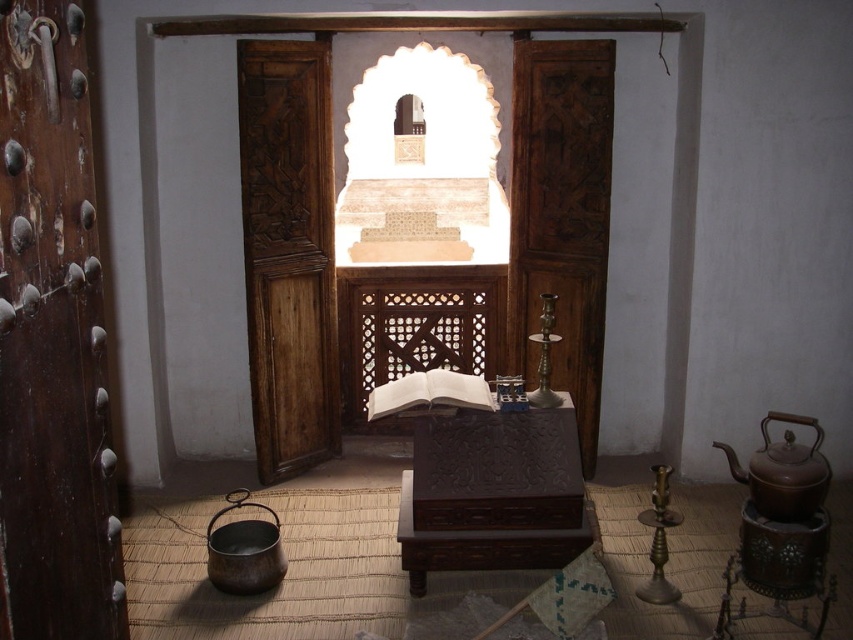
You are a delivery person carrying a package that is 3 meters long. You need to move it through the space between the dark brown wood door at left and the wooden carved door at center. Can you fit the package through the space between them?

The space between the dark brown wood door at left and the wooden carved door at center is 2.86 meters. Since the package is 3 meters long, it cannot fit through the space between them as it is slightly longer than the available distance.

From the picture: You are standing in the room and want to open the wooden carved door at center and the dark wood carved door at center. Which door should you open first to exit the room?

The wooden carved door at center is located below the dark wood carved door at center, so you should open the wooden carved door at center first as it is lower and likely the main entrance.